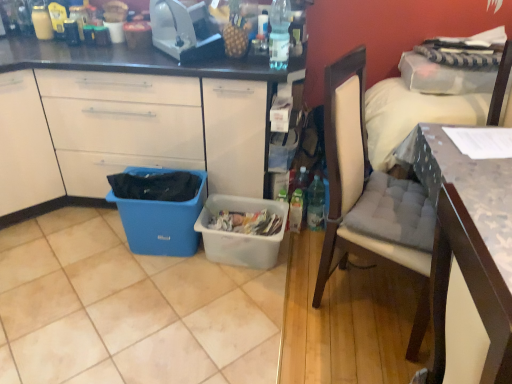
Question: From a real-world perspective, is white plastic toaster at upper center above or below blue plastic bin at lower left?

Choices:
 (A) below
 (B) above

Answer: (B)

Question: Considering the positions of point click(202, 19) and point click(104, 168), is point click(202, 19) closer or farther from the camera than point click(104, 168)?

Choices:
 (A) closer
 (B) farther

Answer: (A)

Question: Which object is the farthest from the white plastic toaster at upper center?

Choices:
 (A) light beige fabric chair at right
 (B) white matte cabinet at left
 (C) blue plastic bin at lower left
 (D) wooden textured desk at right
 (E) clear plastic bottle at upper center

Answer: (D)

Question: Which object is the farthest from the light beige fabric chair at right?

Choices:
 (A) clear plastic bottle at upper center
 (B) wooden textured desk at right
 (C) blue plastic bin at lower left
 (D) blue plastic trash can at lower left
 (E) translucent plastic picnic basket at center

Answer: (C)